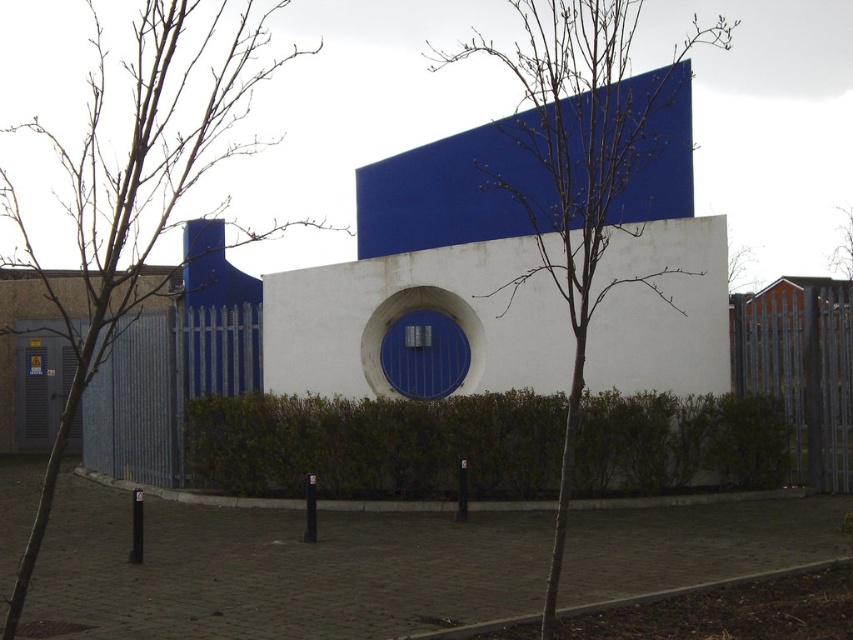
You are standing in front of the modern architectural structure with the blue and white walls. You notice two points marked on the building. The first point is at coordinate point(120, 316) and the second is at point(840, 273). Which point is closer to you?

Point(120, 316) is closer to the camera than point(840, 273), so the first point is closer to you.

You are standing in front of the modern building and want to walk from the bare branches at left to the green leafy hedge at center. Which direction should you move relative to the building?

The green leafy hedge at center is positioned on the right side of the bare branches at left, so you should move to the right to reach it.